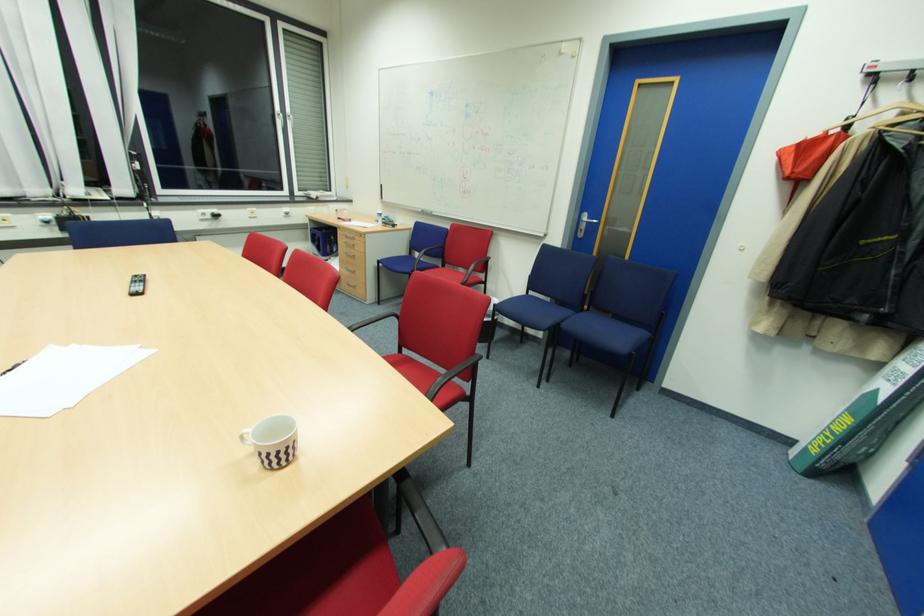
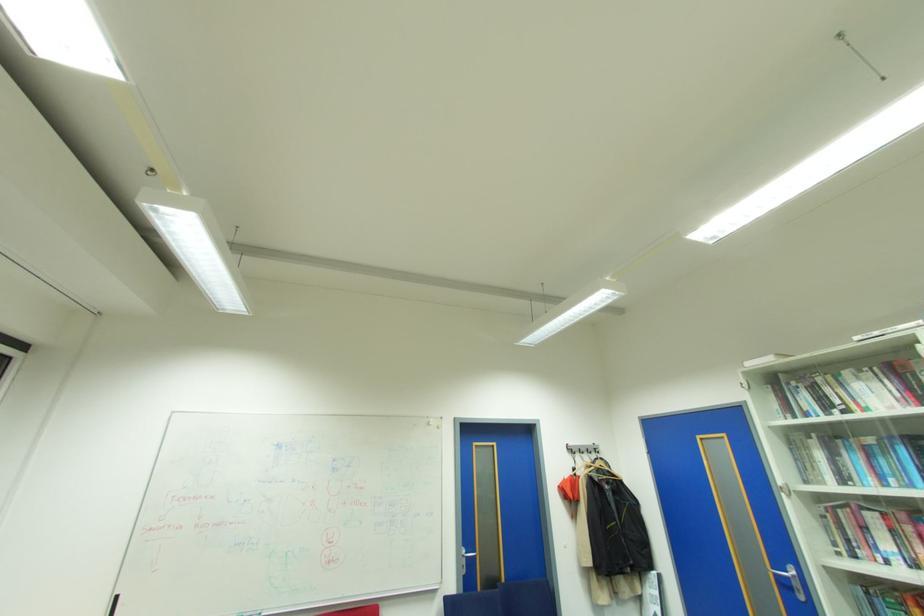
Find the pixel in the second image that matches (432,126) in the first image.

(274, 482)